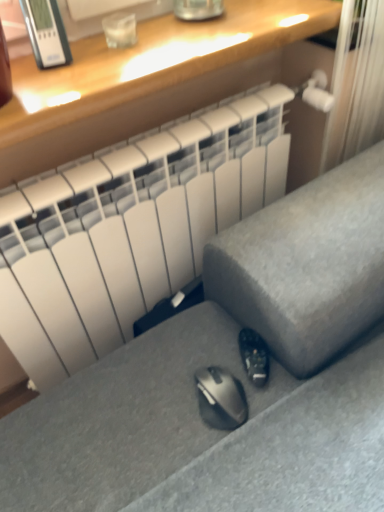
Question: Does black matte shoe at lower center have a larger size compared to matte wood desk at upper center?

Choices:
 (A) no
 (B) yes

Answer: (A)

Question: Is matte wood desk at upper center surrounded by black matte shoe at lower center?

Choices:
 (A) yes
 (B) no

Answer: (B)

Question: From a real-world perspective, is black matte shoe at lower center over matte wood desk at upper center?

Choices:
 (A) no
 (B) yes

Answer: (A)

Question: Is black matte shoe at lower center shorter than matte wood desk at upper center?

Choices:
 (A) no
 (B) yes

Answer: (B)

Question: Would you say black matte shoe at lower center is a long distance from matte wood desk at upper center?

Choices:
 (A) no
 (B) yes

Answer: (A)

Question: From a real-world perspective, is matte wood desk at upper center above or below satin gray sofa at lower center?

Choices:
 (A) above
 (B) below

Answer: (A)

Question: From their relative heights in the image, would you say matte wood desk at upper center is taller or shorter than satin gray sofa at lower center?

Choices:
 (A) short
 (B) tall

Answer: (A)

Question: Considering the positions of point [x=145, y=112] and point [x=87, y=415], is point [x=145, y=112] closer or farther from the camera than point [x=87, y=415]?

Choices:
 (A) farther
 (B) closer

Answer: (A)

Question: Is matte wood desk at upper center inside the boundaries of satin gray sofa at lower center, or outside?

Choices:
 (A) outside
 (B) inside

Answer: (A)

Question: Is point (251, 338) closer or farther from the camera than point (140, 26)?

Choices:
 (A) closer
 (B) farther

Answer: (A)

Question: Is black matte shoe at lower center bigger or smaller than matte wood desk at upper center?

Choices:
 (A) small
 (B) big

Answer: (A)

Question: Based on their positions, is black matte shoe at lower center located to the left or right of matte wood desk at upper center?

Choices:
 (A) left
 (B) right

Answer: (B)

Question: From their relative heights in the image, would you say black matte shoe at lower center is taller or shorter than matte wood desk at upper center?

Choices:
 (A) short
 (B) tall

Answer: (A)

Question: Choose the correct answer: Is satin gray sofa at lower center inside black matte shoe at lower center or outside it?

Choices:
 (A) outside
 (B) inside

Answer: (A)

Question: Is satin gray sofa at lower center to the left or to the right of black matte shoe at lower center in the image?

Choices:
 (A) left
 (B) right

Answer: (B)